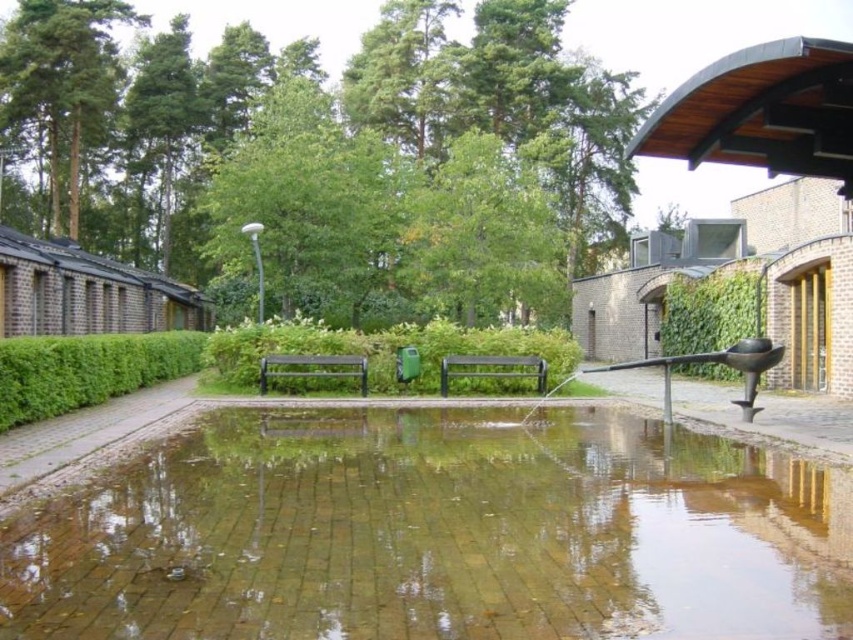
You are standing in the park and want to take a photo of both the green leafy tree at upper center and the green leafy tree at upper left. Which tree should you focus on first to ensure both are in the frame?

You should focus on the green leafy tree at upper left first because it is farther away from you than the green leafy tree at upper center, allowing both to be captured in the frame.

You are a visitor in the park and you want to sit on the black metal bench at center. However, there is a green leafy hedge at center in the way. Can you walk around the hedge to reach the bench?

The black metal bench at center is behind the green leafy hedge at center, so you can walk around the hedge to reach the bench.

You are planning to place a new bench in the park. You see the green leafy hedge at center and the black metal bench at center. Which object is located to the left of the other?

The green leafy hedge at center is to the left of the black metal bench at center.